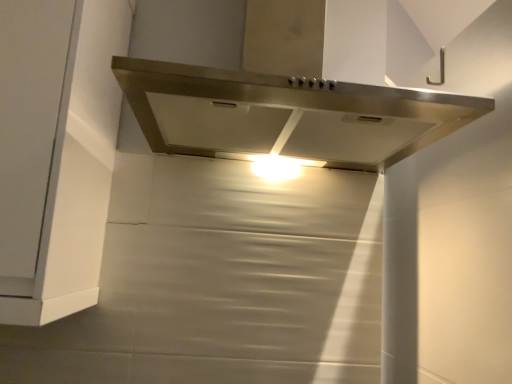
In order to face stainless steel range hood at upper center, should I rotate leftwards or rightwards?

You should look right and rotate roughly 2.928 degrees.

This screenshot has width=512, height=384. I want to click on stainless steel range hood at upper center, so click(x=286, y=105).

The width and height of the screenshot is (512, 384). What do you see at coordinates (286, 105) in the screenshot?
I see `stainless steel range hood at upper center` at bounding box center [286, 105].

Where is `stainless steel range hood at upper center`? The image size is (512, 384). stainless steel range hood at upper center is located at coordinates (286, 105).